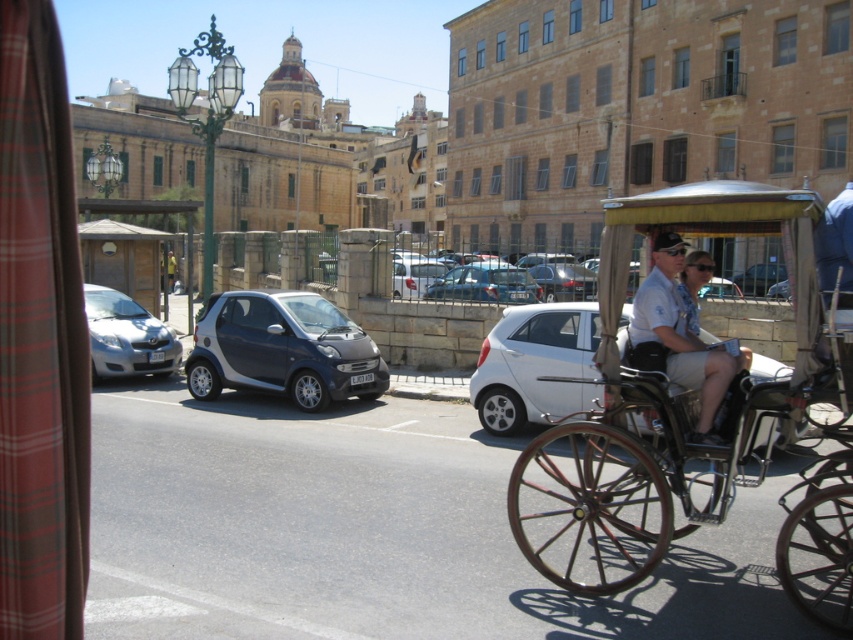
Question: Which of the following is the farthest from the observer?

Choices:
 (A) light blue uniform at center
 (B) metallic gray car at center
 (C) metallic silver car at center

Answer: (C)

Question: Which object is positioned farthest from the wooden cart at right?

Choices:
 (A) light blue uniform at center
 (B) metallic silver car at center
 (C) metallic gray car at center
 (D) white matte car at center

Answer: (B)

Question: Based on their relative distances, which object is farther from the white matte car at center?

Choices:
 (A) light blue uniform at center
 (B) metallic gray car at center
 (C) wooden cart at right
 (D) metallic silver car at center

Answer: (D)

Question: Can you confirm if light blue uniform at center is positioned to the left of metallic silver car at center?

Choices:
 (A) no
 (B) yes

Answer: (A)

Question: Does wooden cart at right appear on the left side of metallic gray car at center?

Choices:
 (A) yes
 (B) no

Answer: (B)

Question: Can you confirm if wooden cart at right is smaller than metallic gray car at center?

Choices:
 (A) no
 (B) yes

Answer: (B)